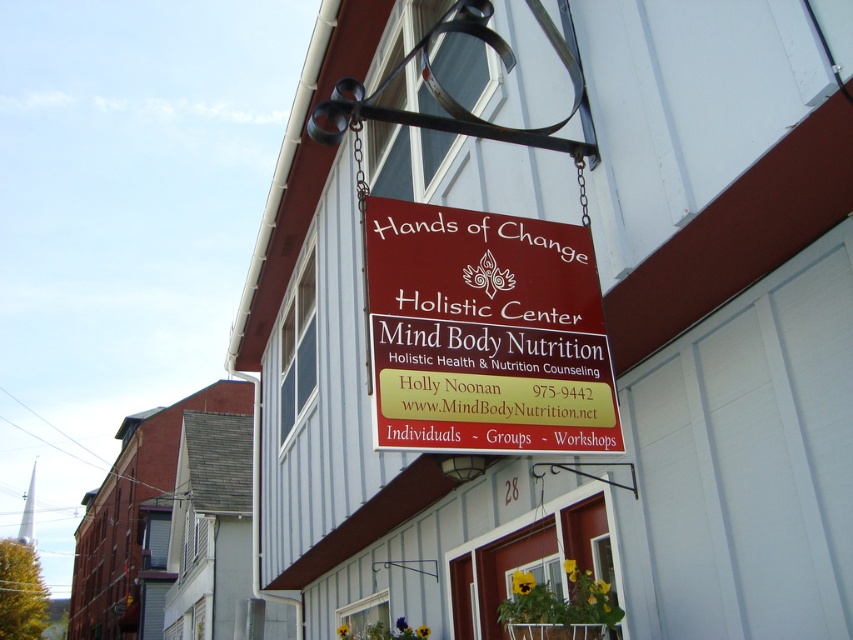
Is matte red sign at center positioned at the back of maroon wood sign at center?

Yes, it is.

Does matte red sign at center have a lesser height compared to maroon wood sign at center?

Correct, matte red sign at center is not as tall as maroon wood sign at center.

Who is more distant from viewer, (595,88) or (497,320)?

The point (595,88) is more distant.

The image size is (853, 640). I want to click on matte red sign at center, so click(x=560, y=316).